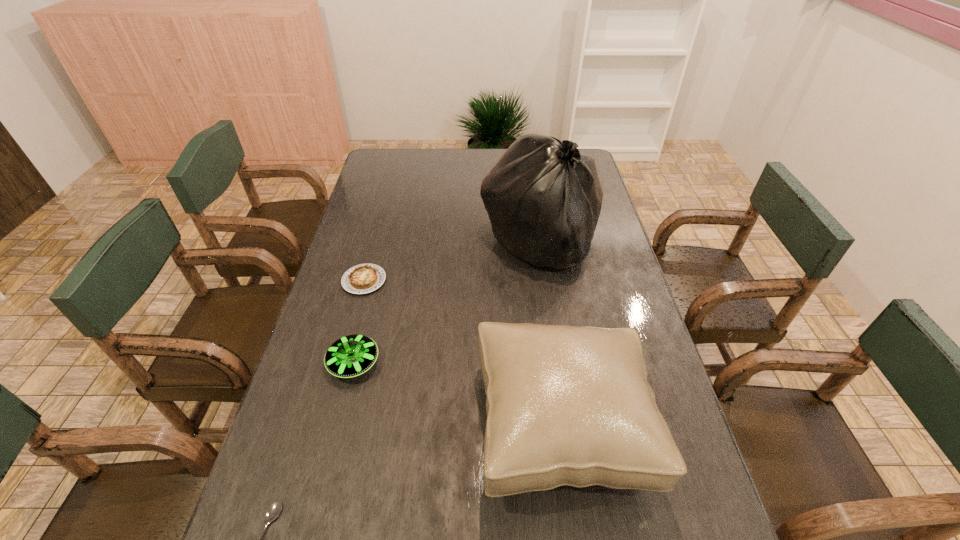
Locate an element on the screen. This screenshot has width=960, height=540. plastic bag located in the right edge section of the desktop is located at coordinates (543, 197).

Identify the location of cushion present at the right edge. (566, 405).

In the image, there is a desktop. Where is `vacant space at the left edge`? vacant space at the left edge is located at coordinates (373, 188).

In the image, there is a desktop. At what (x,y) coordinates should I click in order to perform the action: click on vacant space at the right edge. Please return your answer as a coordinate pair (x, y). Image resolution: width=960 pixels, height=540 pixels. Looking at the image, I should click on (603, 306).

At what (x,y) coordinates should I click in order to perform the action: click on free space that is in between the cushion and the quiche. Please return your answer as a coordinate pair (x, y). This screenshot has height=540, width=960. Looking at the image, I should click on click(x=463, y=353).

Where is `vacant region between the cushion and the quiche`? Image resolution: width=960 pixels, height=540 pixels. vacant region between the cushion and the quiche is located at coordinates (463, 353).

Find the location of a particular element. This screenshot has height=540, width=960. vacant space in between the tallest object and the third shortest object is located at coordinates (446, 303).

At what (x,y) coordinates should I click in order to perform the action: click on free space between the saucer and the tallest object. Please return your answer as a coordinate pair (x, y). Looking at the image, I should click on (446, 303).

Locate an element on the screen. This screenshot has width=960, height=540. free space between the second shortest object and the plastic bag is located at coordinates (451, 262).

In order to click on free area in between the cushion and the fourth tallest object in this screenshot , I will do `click(463, 353)`.